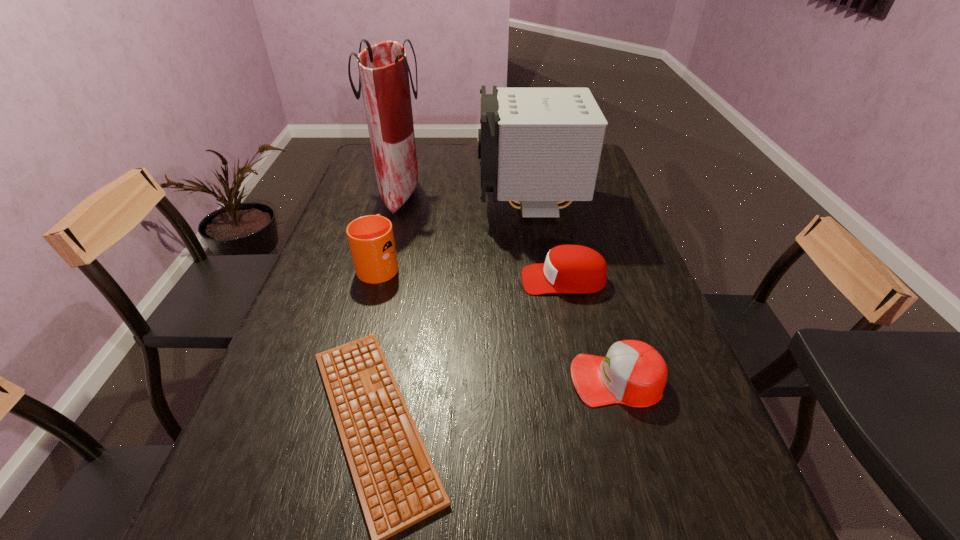
In order to click on free region located on the front-facing side of the farther baseball cap in this screenshot , I will do `click(409, 280)`.

You are a GUI agent. You are given a task and a screenshot of the screen. Output one action in this format:
    pyautogui.click(x=<x>, y=<y>)
    Task: Click on the vacant area situated on the front-facing side of the farther baseball cap
    
    Given the screenshot: What is the action you would take?
    pyautogui.click(x=420, y=280)

In order to click on vacant area situated 0.180m on the front-facing side of the farther baseball cap in this screenshot , I will do `click(454, 280)`.

Where is `free point located on the front-facing side of the nearer baseball cap`? The height and width of the screenshot is (540, 960). free point located on the front-facing side of the nearer baseball cap is located at coordinates (480, 380).

Locate an element on the screen. The image size is (960, 540). vacant area located on the front-facing side of the nearer baseball cap is located at coordinates (541, 380).

I want to click on vacant space located 0.380m on the front-facing side of the nearer baseball cap, so click(390, 380).

Locate an element on the screen. object situated at the far edge is located at coordinates (383, 69).

You are a GUI agent. You are given a task and a screenshot of the screen. Output one action in this format:
    pyautogui.click(x=<x>, y=<y>)
    Task: Click on the grocery bag situated at the left edge
    The image size is (960, 540).
    Given the screenshot: What is the action you would take?
    pyautogui.click(x=383, y=69)

The image size is (960, 540). I want to click on mug located at the left edge, so click(x=371, y=239).

Where is `fan that is at the right edge`? fan that is at the right edge is located at coordinates (537, 146).